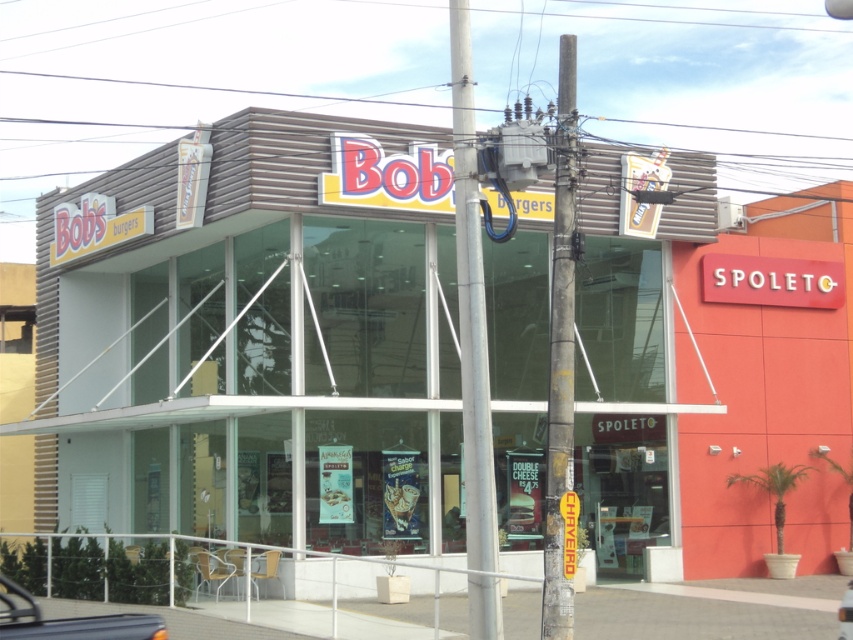
Question: Does matte brown building at center appear under rusty metal pole at center?

Choices:
 (A) no
 (B) yes

Answer: (B)

Question: From the image, what is the correct spatial relationship of matte brown building at center in relation to rusty metal pole at center?

Choices:
 (A) below
 (B) above

Answer: (A)

Question: From the image, what is the correct spatial relationship of metallic silver car at lower left in relation to metallic silver car at lower right?

Choices:
 (A) above
 (B) below

Answer: (A)

Question: Among these points, which one is farthest from the camera?

Choices:
 (A) (463, 497)
 (B) (122, 634)
 (C) (561, 225)
 (D) (840, 634)

Answer: (A)

Question: Which of these objects is positioned closest to the matte brown building at center?

Choices:
 (A) metallic silver car at lower left
 (B) metallic silver car at lower right
 (C) rusty metal pole at center

Answer: (C)

Question: Estimate the real-world distances between objects in this image. Which object is closer to the metallic silver car at lower right?

Choices:
 (A) metallic silver car at lower left
 (B) metallic pole at center

Answer: (B)